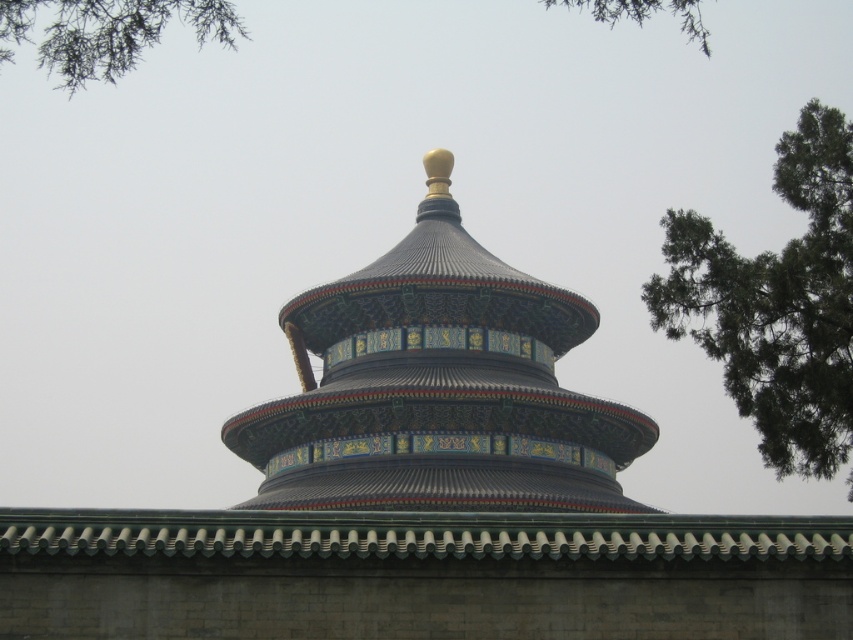
Question: Which point appears closest to the camera in this image?

Choices:
 (A) (587, 3)
 (B) (811, 305)
 (C) (61, 51)

Answer: (B)

Question: Does green leafy tree at upper left appear over green leafy branch at upper right?

Choices:
 (A) yes
 (B) no

Answer: (B)

Question: Which of these objects is positioned farthest from the green leafy branch at upper right?

Choices:
 (A) green leafy tree at upper left
 (B) green leafy tree at upper right

Answer: (A)

Question: Which point appears closest to the camera in this image?

Choices:
 (A) pos(666,294)
 (B) pos(74,45)
 (C) pos(701,29)
 (D) pos(570,486)

Answer: (B)

Question: Does green leafy tree at upper left have a lesser width compared to green leafy branch at upper right?

Choices:
 (A) yes
 (B) no

Answer: (B)

Question: Considering the relative positions of glossy ceramic dome at center and green leafy tree at upper left in the image provided, where is glossy ceramic dome at center located with respect to green leafy tree at upper left?

Choices:
 (A) above
 (B) below

Answer: (B)